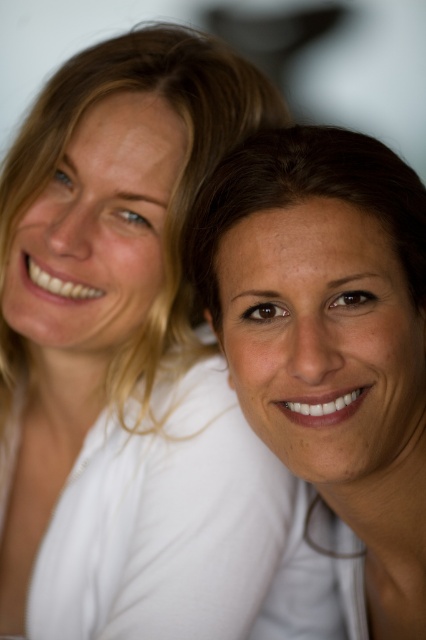
Question: Does matte white shirt at upper left come in front of smooth skin face at center?

Choices:
 (A) yes
 (B) no

Answer: (B)

Question: Can you confirm if matte white shirt at upper left is wider than smooth skin face at center?

Choices:
 (A) no
 (B) yes

Answer: (B)

Question: Where is matte white shirt at upper left located in relation to smooth skin face at center in the image?

Choices:
 (A) right
 (B) left

Answer: (B)